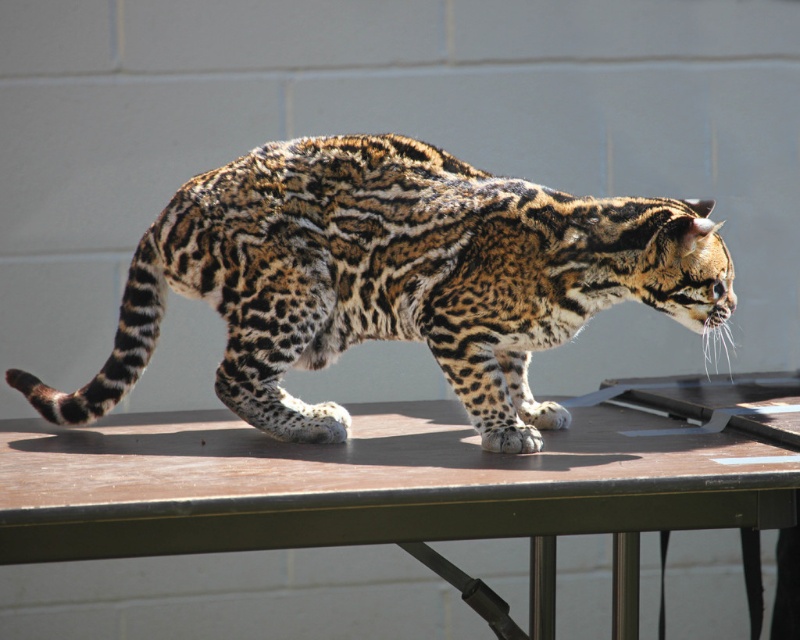
Is the position of leopard print fur cat at center more distant than that of brown wood table at center?

Yes.

In order to click on leopard print fur cat at center in this screenshot , I will do `click(396, 278)`.